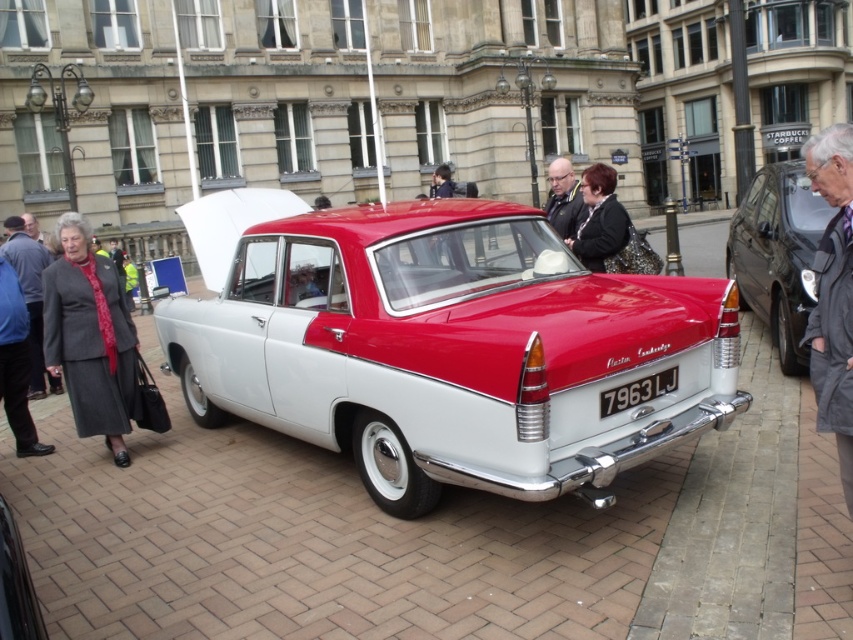
Can you confirm if gray woolen suit at lower left is smaller than shiny black car at center?

No, gray woolen suit at lower left is not smaller than shiny black car at center.

Is gray woolen suit at lower left wider than shiny black car at center?

Indeed, gray woolen suit at lower left has a greater width compared to shiny black car at center.

Is point (122, 436) less distant than point (35, 600)?

No, it is behind (35, 600).

Identify the location of gray woolen suit at lower left. (90, 337).

Which is more to the left, shiny black sedan at right or gray wool coat at lower left?

From the viewer's perspective, gray wool coat at lower left appears more on the left side.

Is shiny black sedan at right smaller than gray wool coat at lower left?

No.

Measure the distance between point [796,289] and camera.

Point [796,289] and camera are 5.83 meters apart.

Find the location of a particular element. Image resolution: width=853 pixels, height=640 pixels. shiny black sedan at right is located at coordinates (778, 253).

Who is positioned more to the right, gray wool coat at lower left or white metallic license plate at center?

From the viewer's perspective, white metallic license plate at center appears more on the right side.

The image size is (853, 640). In order to click on gray wool coat at lower left in this screenshot , I will do `click(30, 296)`.